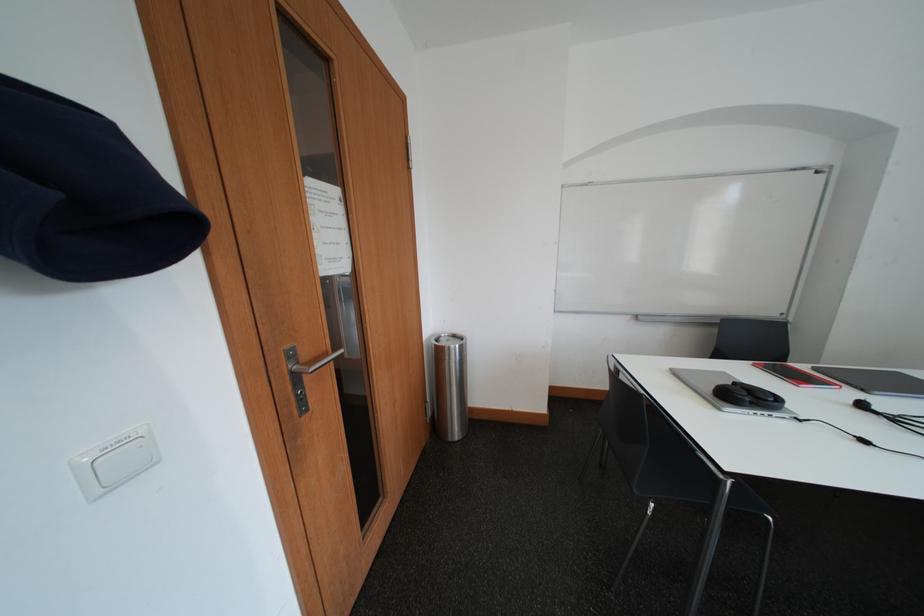
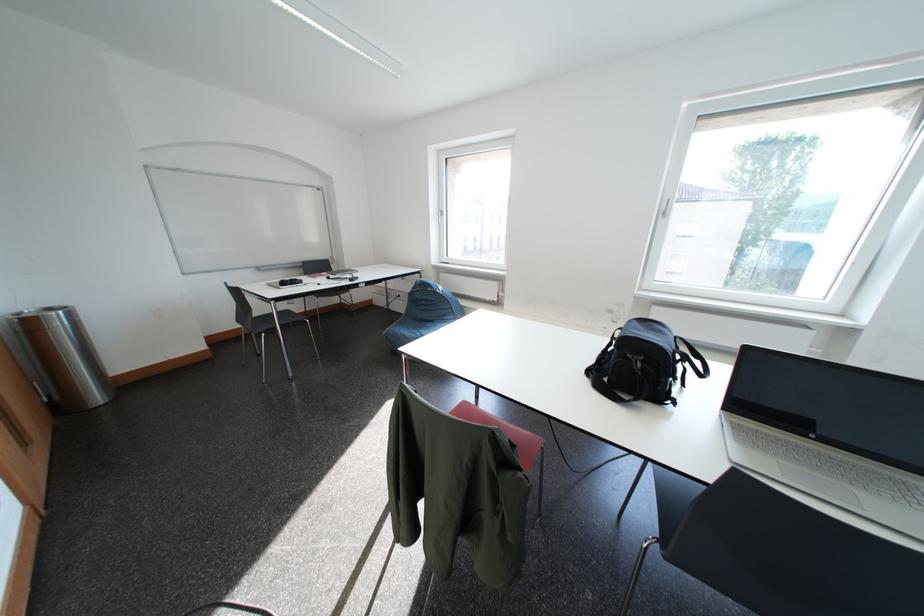
In the second image, find the point that corresponds to (x=466, y=339) in the first image.

(59, 312)